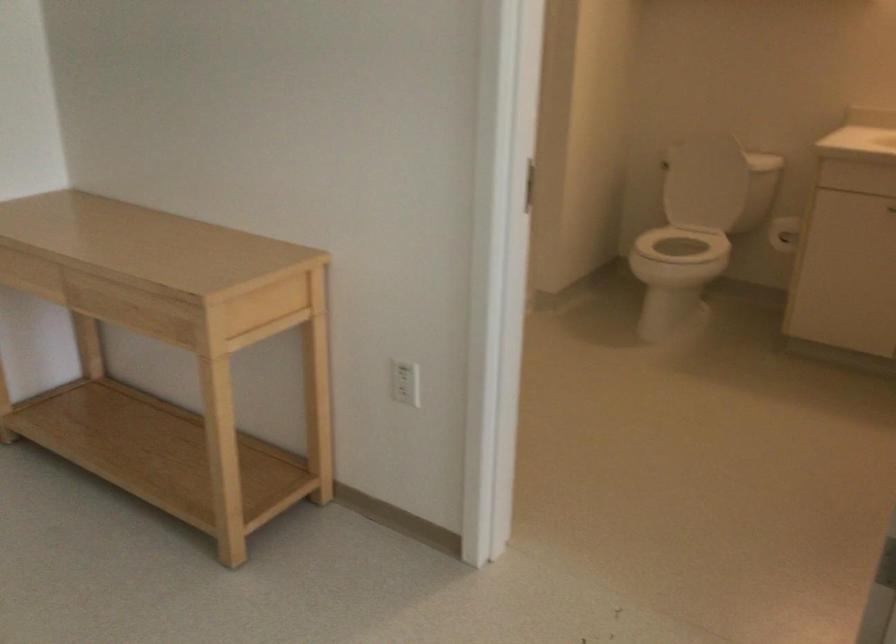
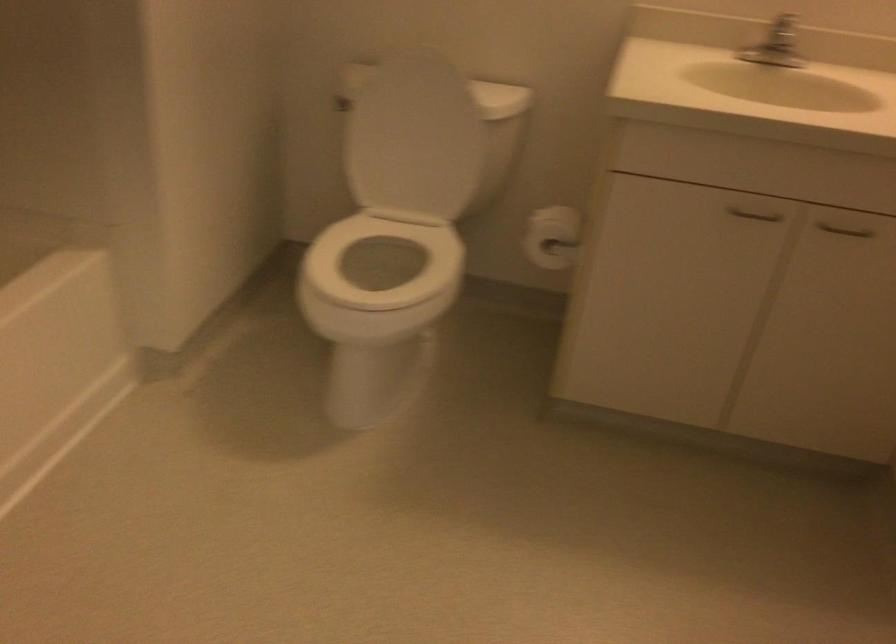
The point at (728, 129) is marked in the first image. Where is the corresponding point in the second image?

(440, 61)